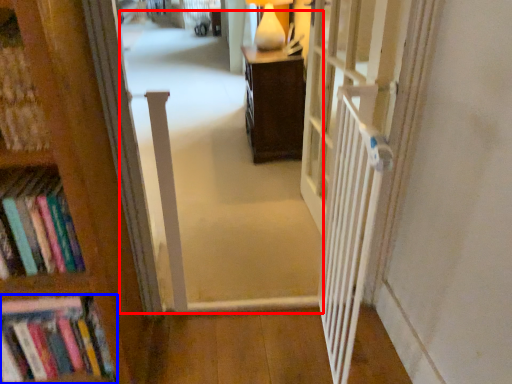
Question: Which object appears closest to the camera in this image, corridor (highlighted by a red box) or book (highlighted by a blue box)?

Choices:
 (A) corridor
 (B) book

Answer: (B)